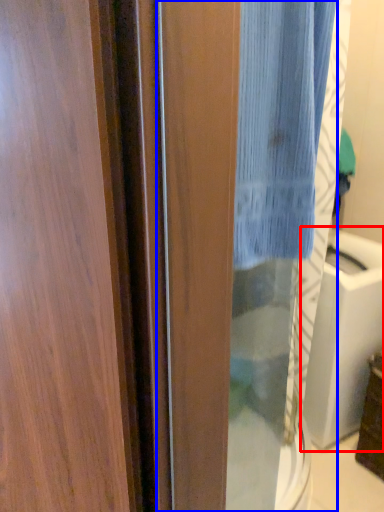
Question: Which object appears closest to the camera in this image, sink (highlighted by a red box) or screen door (highlighted by a blue box)?

Choices:
 (A) sink
 (B) screen door

Answer: (B)